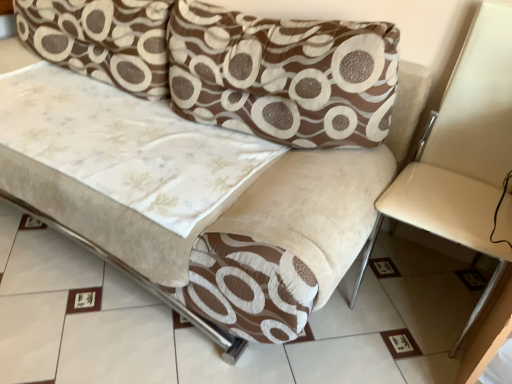
Question: Which direction should I rotate to look at brown textured pillow at upper center, which is counted as the 1th pillow, starting from the right, — up or down?

Choices:
 (A) down
 (B) up

Answer: (B)

Question: Is brown textured pillow at upper center, which is counted as the 1th pillow, starting from the right, at the right side of beige fabric armchair at right?

Choices:
 (A) yes
 (B) no

Answer: (B)

Question: From a real-world perspective, is brown textured pillow at upper center, which is counted as the 1th pillow, starting from the right, physically above beige fabric armchair at right?

Choices:
 (A) no
 (B) yes

Answer: (B)

Question: From the image's perspective, is brown textured pillow at upper center, which is the second pillow in left-to-right order, beneath beige fabric armchair at right?

Choices:
 (A) no
 (B) yes

Answer: (A)

Question: Does brown textured pillow at upper center, which is counted as the 1th pillow, starting from the right, have a larger size compared to beige fabric armchair at right?

Choices:
 (A) no
 (B) yes

Answer: (A)

Question: Is brown textured pillow at upper center, which is counted as the 1th pillow, starting from the right, further to the viewer compared to beige fabric armchair at right?

Choices:
 (A) no
 (B) yes

Answer: (B)

Question: Is beige fabric armchair at right surrounded by brown textured pillow at upper center, which is the second pillow in left-to-right order?

Choices:
 (A) no
 (B) yes

Answer: (A)

Question: From a real-world perspective, is brown textured pillow at upper left, arranged as the first pillow when viewed from the left, positioned over beige fabric armchair at right based on gravity?

Choices:
 (A) no
 (B) yes

Answer: (B)

Question: Is brown textured pillow at upper left, arranged as the first pillow when viewed from the left, oriented away from beige fabric armchair at right?

Choices:
 (A) no
 (B) yes

Answer: (A)

Question: From the image's perspective, is brown textured pillow at upper left, arranged as the first pillow when viewed from the left, above beige fabric armchair at right?

Choices:
 (A) no
 (B) yes

Answer: (B)

Question: Is brown textured pillow at upper left, arranged as the first pillow when viewed from the left, at the left side of beige fabric armchair at right?

Choices:
 (A) yes
 (B) no

Answer: (A)

Question: Could beige fabric armchair at right be considered to be inside brown textured pillow at upper left, arranged as the first pillow when viewed from the left?

Choices:
 (A) no
 (B) yes

Answer: (A)

Question: Can you confirm if brown textured pillow at upper left, arranged as the first pillow when viewed from the left, is wider than beige fabric armchair at right?

Choices:
 (A) no
 (B) yes

Answer: (A)

Question: Does brown textured pillow at upper center, which is the second pillow in left-to-right order, contain brown textured pillow at upper left, arranged as the first pillow when viewed from the left?

Choices:
 (A) yes
 (B) no

Answer: (B)